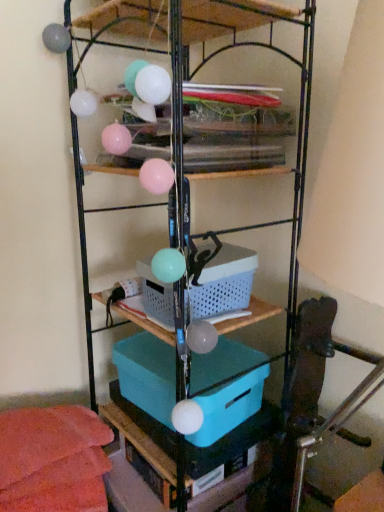
Question: From the image's perspective, is plastic/mesh basket at center positioned above or below blue plastic basket at center?

Choices:
 (A) below
 (B) above

Answer: (B)

Question: From a real-world perspective, is plastic/mesh basket at center positioned above or below blue plastic basket at center?

Choices:
 (A) above
 (B) below

Answer: (A)

Question: Which object is positioned farthest from the blue plastic basket at center?

Choices:
 (A) plastic/mesh basket at center
 (B) teal plastic box at center

Answer: (B)

Question: Which is farther from the blue plastic basket at center?

Choices:
 (A) teal plastic box at center
 (B) plastic/mesh basket at center

Answer: (A)